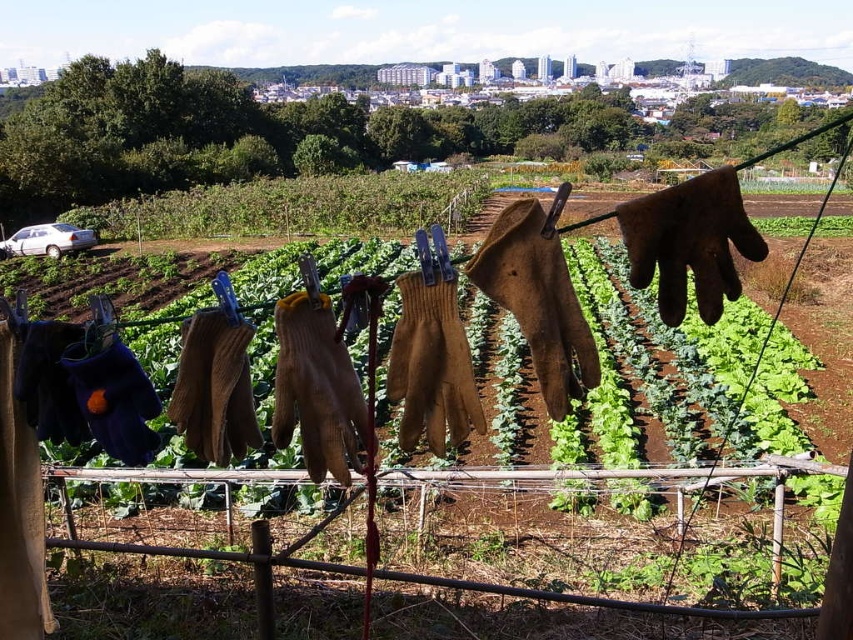
You are standing in the garden looking at the brown wooden fence at center and the green leafy at center. Which object is positioned higher in the image?

The green leafy at center is positioned higher than the brown wooden fence at center.